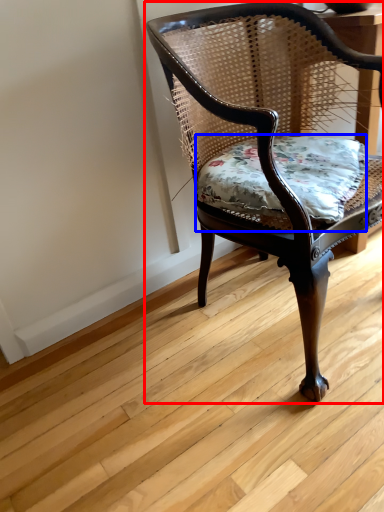
Question: Which object is further to the camera taking this photo, chair (highlighted by a red box) or pillow (highlighted by a blue box)?

Choices:
 (A) chair
 (B) pillow

Answer: (B)